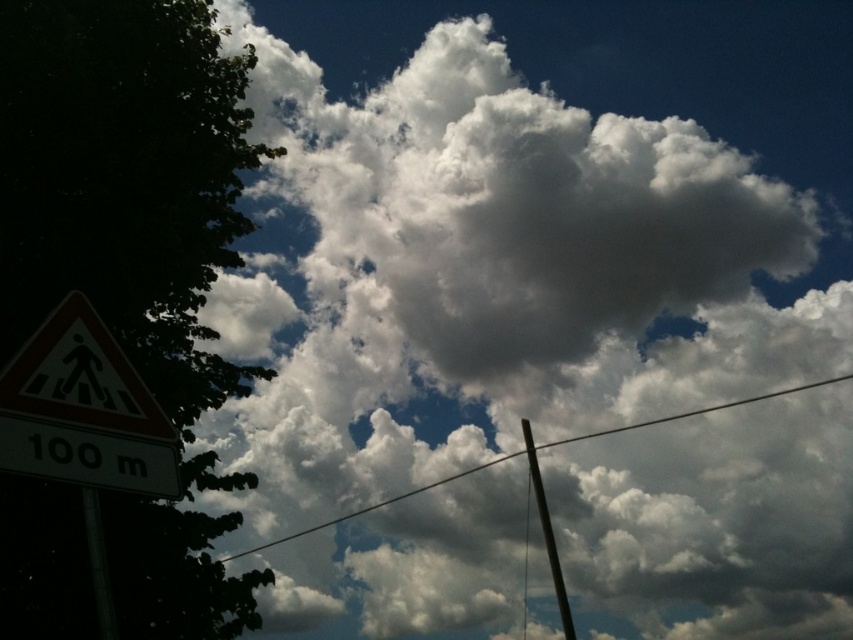
Is point (161, 604) closer to viewer compared to point (39, 412)?

No, (161, 604) is further to viewer.

Does green leafy tree at left appear over white plastic pedestrian sign at lower left?

Yes.

Is point (47, 150) behind point (22, 448)?

Yes, it is.

This screenshot has width=853, height=640. What are the coordinates of `green leafy tree at left` in the screenshot? It's located at (125, 180).

Describe the element at coordinates (125, 180) in the screenshot. The width and height of the screenshot is (853, 640). I see `green leafy tree at left` at that location.

Is green leafy tree at left to the left of white wire at center from the viewer's perspective?

Indeed, green leafy tree at left is positioned on the left side of white wire at center.

The height and width of the screenshot is (640, 853). What are the coordinates of `green leafy tree at left` in the screenshot? It's located at (125, 180).

Which is below, white wire at center or metallic pole at center?

metallic pole at center

Does white wire at center appear over metallic pole at center?

Yes, white wire at center is above metallic pole at center.

The height and width of the screenshot is (640, 853). In order to click on white wire at center in this screenshot , I will do `click(376, 506)`.